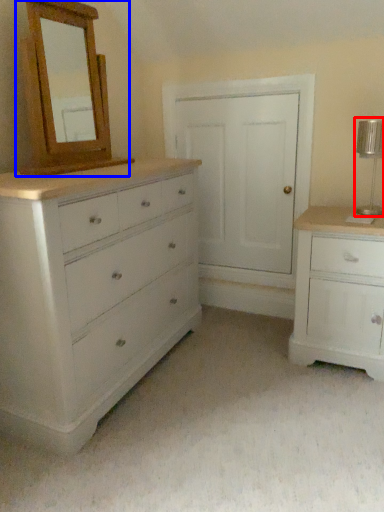
Question: Which of the following is the farthest to the observer, table lamp (highlighted by a red box) or medicine cabinet (highlighted by a blue box)?

Choices:
 (A) table lamp
 (B) medicine cabinet

Answer: (A)